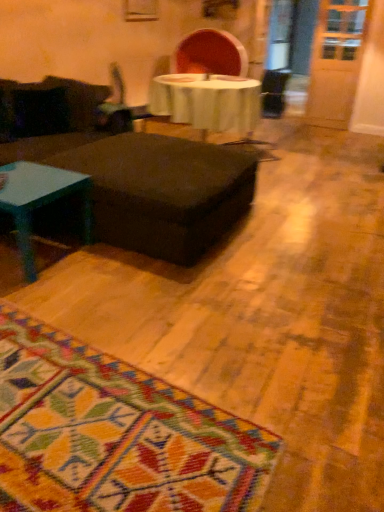
Locate an element on the screen. teal glossy coffee table at left is located at coordinates (40, 201).

In order to face metallic silver swivel chair at center, should I rotate leftwards or rightwards?

Rotate your view left by about 8.329°.

Find the location of `teal glossy coffee table at left`. teal glossy coffee table at left is located at coordinates (40, 201).

Would you say matte black ottoman at center is outside teal glossy coffee table at left?

matte black ottoman at center is positioned outside teal glossy coffee table at left.

From the image's perspective, relative to teal glossy coffee table at left, is matte black ottoman at center above or below?

Clearly, from the image's perspective, matte black ottoman at center is above teal glossy coffee table at left.

Is matte black ottoman at center placed right next to teal glossy coffee table at left?

No, matte black ottoman at center is not touching teal glossy coffee table at left.

Measure the distance from metallic silver swivel chair at center to teal glossy coffee table at left.

metallic silver swivel chair at center is 1.31 meters from teal glossy coffee table at left.

From the image's perspective, which is above, metallic silver swivel chair at center or teal glossy coffee table at left?

metallic silver swivel chair at center, from the image's perspective.

Is metallic silver swivel chair at center oriented towards teal glossy coffee table at left?

No.

From a real-world perspective, which is physically below, metallic silver swivel chair at center or teal glossy coffee table at left?

teal glossy coffee table at left is physically lower.

How different are the orientations of metallic silver swivel chair at center and matte black ottoman at center in degrees?

32.5 degrees.

From a real-world perspective, is metallic silver swivel chair at center on top of matte black ottoman at center?

Yes.

What are the coordinates of `table located on the right of metallic silver swivel chair at center` in the screenshot? It's located at (162, 191).

Can you see metallic silver swivel chair at center touching matte black ottoman at center?

No, metallic silver swivel chair at center is not beside matte black ottoman at center.

Which object is closer to the camera taking this photo, teal glossy coffee table at left or matte black ottoman at center?

teal glossy coffee table at left is in front.

In the scene shown: Considering the relative sizes of teal glossy coffee table at left and matte black ottoman at center in the image provided, is teal glossy coffee table at left shorter than matte black ottoman at center?

Yes.

Find the location of a particular element. table above the teal glossy coffee table at left (from a real-world perspective) is located at coordinates (162, 191).

Can you tell me how much teal glossy coffee table at left and matte black ottoman at center differ in facing direction?

There is a 0.284-degree angle between the facing directions of teal glossy coffee table at left and matte black ottoman at center.

Is matte black ottoman at center not inside metallic silver swivel chair at center?

matte black ottoman at center lies outside metallic silver swivel chair at center's area.

You are a GUI agent. You are given a task and a screenshot of the screen. Output one action in this format:
    pyautogui.click(x=<x>, y=<y>)
    Task: Click on the table below the metallic silver swivel chair at center (from the image's perspective)
    The height and width of the screenshot is (512, 384).
    Given the screenshot: What is the action you would take?
    pyautogui.click(x=162, y=191)

Is matte black ottoman at center placed right next to metallic silver swivel chair at center?

No, matte black ottoman at center is not beside metallic silver swivel chair at center.

Considering the sizes of matte black ottoman at center and metallic silver swivel chair at center in the image, is matte black ottoman at center wider or thinner than metallic silver swivel chair at center?

In the image, matte black ottoman at center appears to be wider than metallic silver swivel chair at center.

Which of these two, teal glossy coffee table at left or metallic silver swivel chair at center, stands taller?

Standing taller between the two is metallic silver swivel chair at center.

Considering the points (20, 203) and (115, 72), which point is behind, point (20, 203) or point (115, 72)?

The point (115, 72) is farther.

Are teal glossy coffee table at left and metallic silver swivel chair at center beside each other?

There is a gap between teal glossy coffee table at left and metallic silver swivel chair at center.

You are a GUI agent. You are given a task and a screenshot of the screen. Output one action in this format:
    pyautogui.click(x=<x>, y=<y>)
    Task: Click on the coffee table lying in front of the metallic silver swivel chair at center
    The height and width of the screenshot is (512, 384).
    Given the screenshot: What is the action you would take?
    click(40, 201)

Find the location of a particular element. The width and height of the screenshot is (384, 512). table above the teal glossy coffee table at left (from the image's perspective) is located at coordinates (162, 191).

I want to click on swivel chair behind the teal glossy coffee table at left, so click(x=122, y=106).

When comparing their distances from teal glossy coffee table at left, does matte black ottoman at center or metallic silver swivel chair at center seem closer?

The object closer to teal glossy coffee table at left is matte black ottoman at center.

When comparing their distances from metallic silver swivel chair at center, does teal glossy coffee table at left or matte black ottoman at center seem closer?

matte black ottoman at center is closer to metallic silver swivel chair at center.

Estimate the real-world distances between objects in this image. Which object is closer to matte black ottoman at center, teal glossy coffee table at left or metallic silver swivel chair at center?

teal glossy coffee table at left is positioned closer to the anchor matte black ottoman at center.

Based on their spatial positions, is metallic silver swivel chair at center or teal glossy coffee table at left further from matte black ottoman at center?

metallic silver swivel chair at center is further to matte black ottoman at center.

Based on their spatial positions, is metallic silver swivel chair at center or matte black ottoman at center closer to teal glossy coffee table at left?

matte black ottoman at center lies closer to teal glossy coffee table at left than the other object.

From the image, which object appears to be farther from metallic silver swivel chair at center, matte black ottoman at center or teal glossy coffee table at left?

Among the two, teal glossy coffee table at left is located further to metallic silver swivel chair at center.

You are a GUI agent. You are given a task and a screenshot of the screen. Output one action in this format:
    pyautogui.click(x=<x>, y=<y>)
    Task: Click on the table between teal glossy coffee table at left and metallic silver swivel chair at center along the z-axis
    The image size is (384, 512).
    Given the screenshot: What is the action you would take?
    pyautogui.click(x=162, y=191)